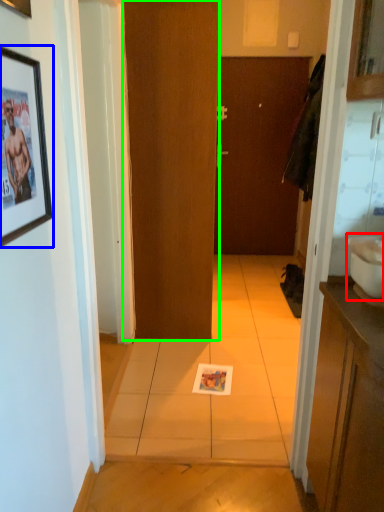
Question: Which is nearer to the sink (highlighted by a red box)? picture frame (highlighted by a blue box) or door (highlighted by a green box).

Choices:
 (A) picture frame
 (B) door

Answer: (A)